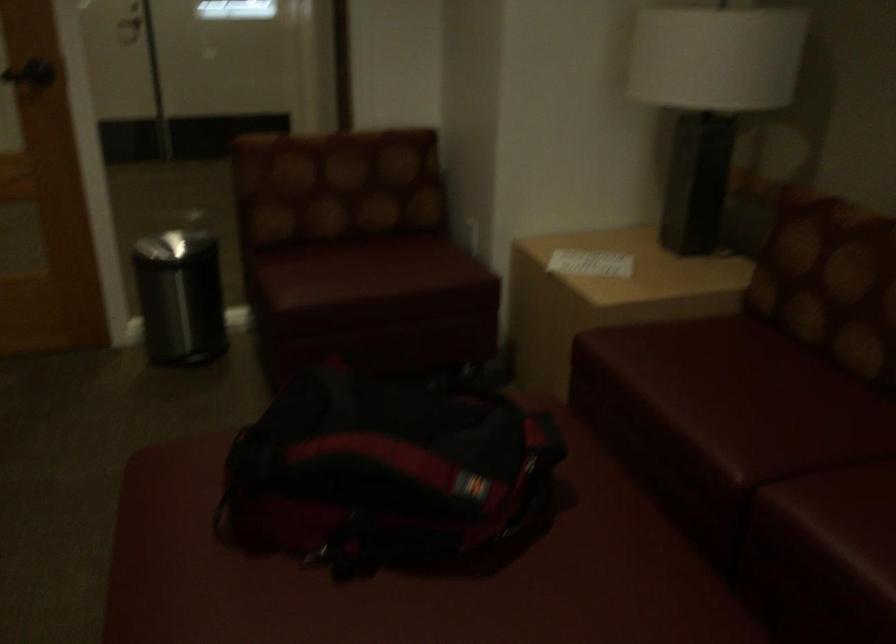
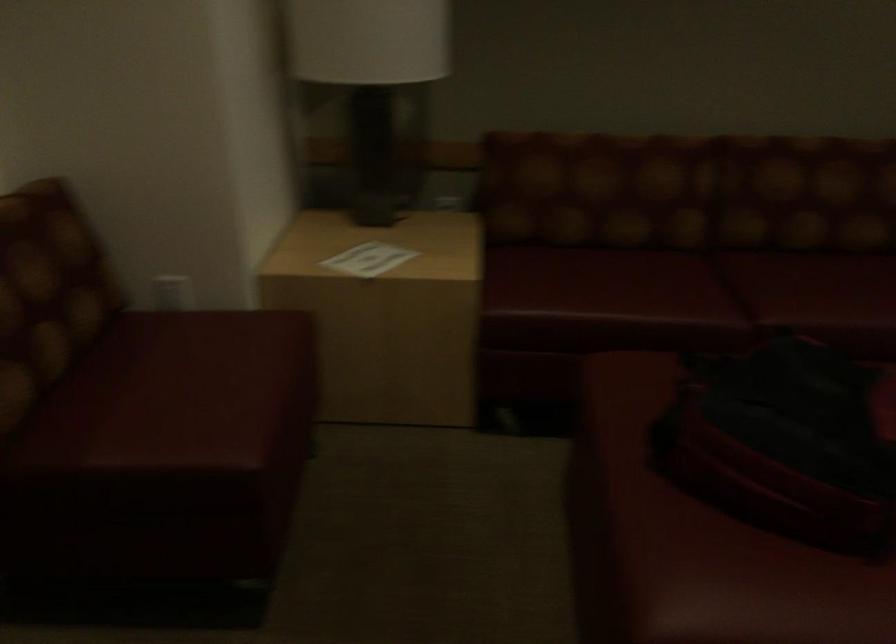
Locate, in the second image, the point that corresponds to [799,436] in the first image.

(698, 286)